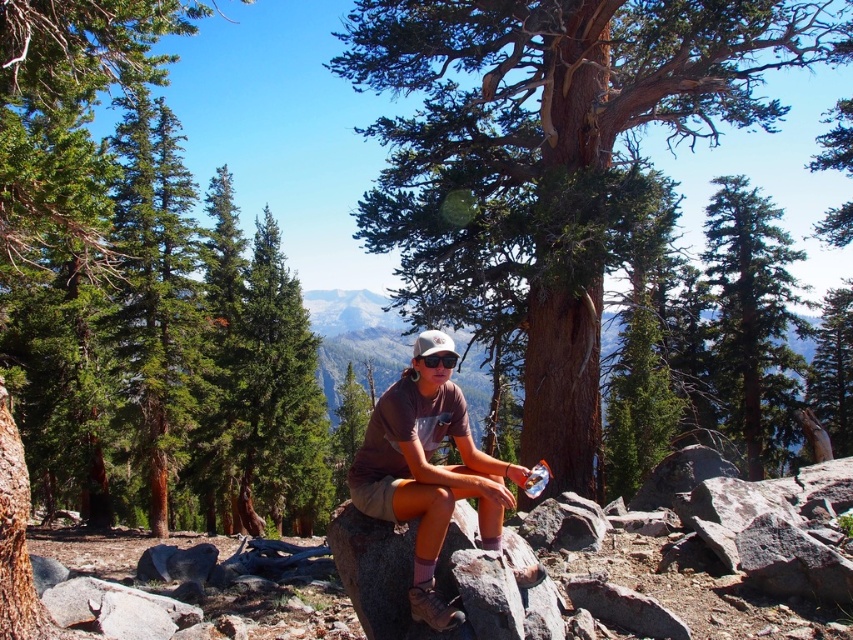
Question: Is smooth brown tree trunk at center bigger than brown rough rock at center?

Choices:
 (A) no
 (B) yes

Answer: (B)

Question: Considering the real-world distances, which object is closest to the smooth brown tree trunk at center?

Choices:
 (A) brown cotton shirt at center
 (B) brown rough rock at center

Answer: (B)

Question: Among these objects, which one is farthest from the camera?

Choices:
 (A) smooth brown tree trunk at center
 (B) brown cotton shirt at center
 (C) green coniferous tree at upper right
 (D) brown rough rock at center

Answer: (C)

Question: Which object is positioned closest to the green coniferous tree at upper right?

Choices:
 (A) smooth brown tree trunk at center
 (B) brown rough rock at center
 (C) brown cotton shirt at center

Answer: (A)

Question: Is green coniferous tree at upper right wider than brown rough rock at center?

Choices:
 (A) yes
 (B) no

Answer: (A)

Question: Does smooth brown tree trunk at center come in front of brown cotton shirt at center?

Choices:
 (A) yes
 (B) no

Answer: (B)